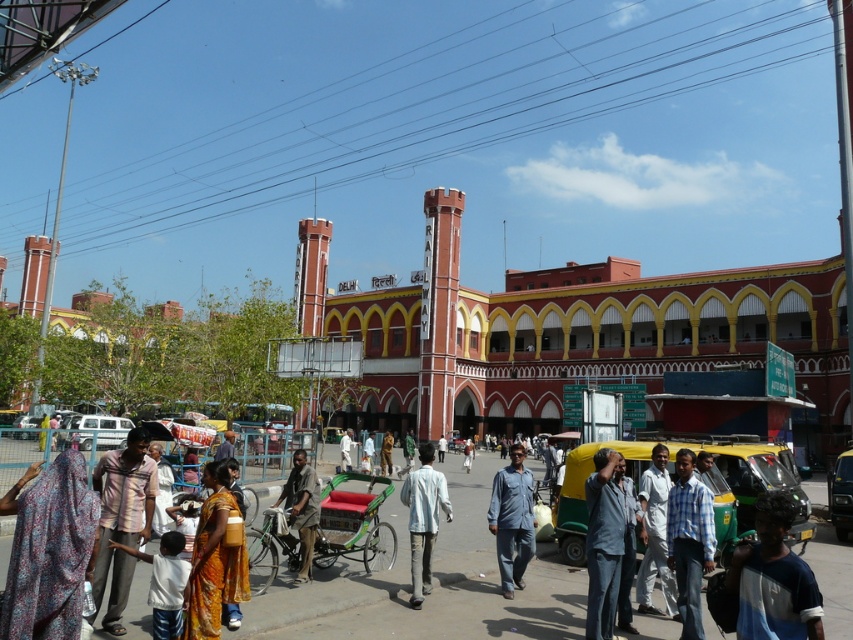
Question: Which point is closer to the camera?

Choices:
 (A) (682, 637)
 (B) (410, 506)
 (C) (355, 444)
 (D) (645, 474)

Answer: (A)

Question: Does denim shirt at center have a lesser width compared to light blue denim shirt at center?

Choices:
 (A) no
 (B) yes

Answer: (A)

Question: Based on their relative distances, which object is farther from the light brown fabric at center?

Choices:
 (A) orange printed sari at center
 (B) denim pants at center

Answer: (A)

Question: Which object is the closest to the light blue cotton shirt at lower left?

Choices:
 (A) light blue denim shirt at center
 (B) light brown fabric at lower left

Answer: (B)

Question: Where is denim shirt at center located in relation to light blue cotton shirt at lower left in the image?

Choices:
 (A) right
 (B) left

Answer: (A)

Question: Is printed fabric headscarf at lower left positioned behind light blue shirt at center?

Choices:
 (A) yes
 (B) no

Answer: (B)